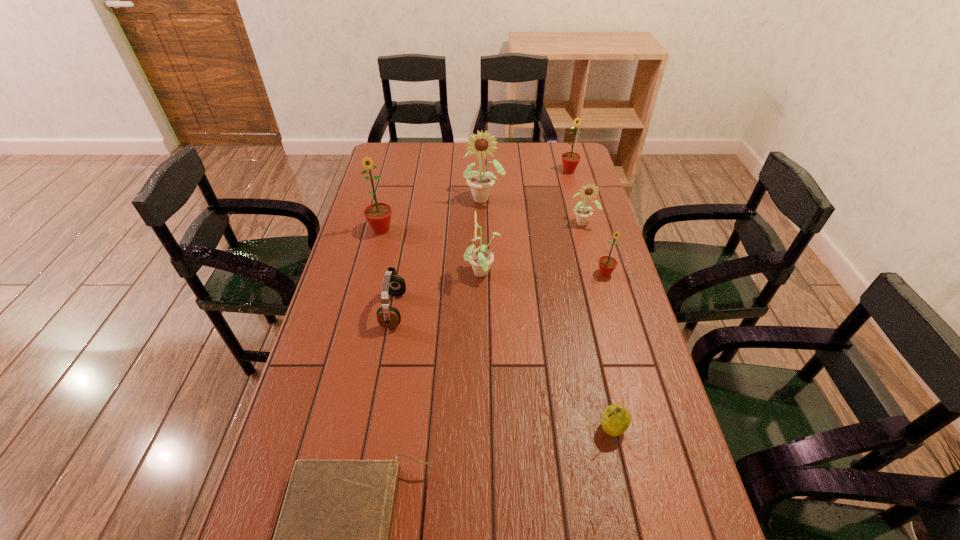
Identify which object is the fifth closest to the fifth nearest sunflower. Please provide its 2D coordinates. Your answer should be formatted as a tuple, i.e. [(x, y)], where the tuple contains the x and y coordinates of a point satisfying the conditions above.

[(607, 264)]

Choose which sunflower is the third nearest neighbor to the third shortest object. Please provide its 2D coordinates. Your answer should be formatted as a tuple, i.e. [(x, y)], where the tuple contains the x and y coordinates of a point satisfying the conditions above.

[(583, 213)]

Where is `sunflower identified as the third closest to the farthest object`? The width and height of the screenshot is (960, 540). sunflower identified as the third closest to the farthest object is located at coordinates (607, 264).

Where is `yellow sunflower identified as the closest to the smallest green sunflower`? This screenshot has height=540, width=960. yellow sunflower identified as the closest to the smallest green sunflower is located at coordinates (583, 213).

Choose which yellow sunflower is the second nearest neighbor to the nearest yellow sunflower. Please provide its 2D coordinates. Your answer should be formatted as a tuple, i.e. [(x, y)], where the tuple contains the x and y coordinates of a point satisfying the conditions above.

[(583, 213)]

Where is `green sunflower that can be found as the third closest to the seventh tallest object`? green sunflower that can be found as the third closest to the seventh tallest object is located at coordinates (570, 160).

The height and width of the screenshot is (540, 960). Identify the location of green sunflower that is the second closest one to the pear. (378, 215).

This screenshot has height=540, width=960. What are the coordinates of `blank area in the image that satisfies the following two spatial constraints: 1. on the face of the second farthest green sunflower; 2. on the right side of the eighth farthest object` in the screenshot? It's located at (331, 428).

This screenshot has width=960, height=540. Identify the location of vacant position in the image that satisfies the following two spatial constraints: 1. on the front-facing side of the second farthest sunflower; 2. on the ear cups of the fourth nearest object. (485, 310).

The height and width of the screenshot is (540, 960). Find the location of `vacant space that satisfies the following two spatial constraints: 1. on the front-facing side of the biggest yellow sunflower; 2. on the front-facing side of the nearest yellow sunflower`. vacant space that satisfies the following two spatial constraints: 1. on the front-facing side of the biggest yellow sunflower; 2. on the front-facing side of the nearest yellow sunflower is located at coordinates (485, 274).